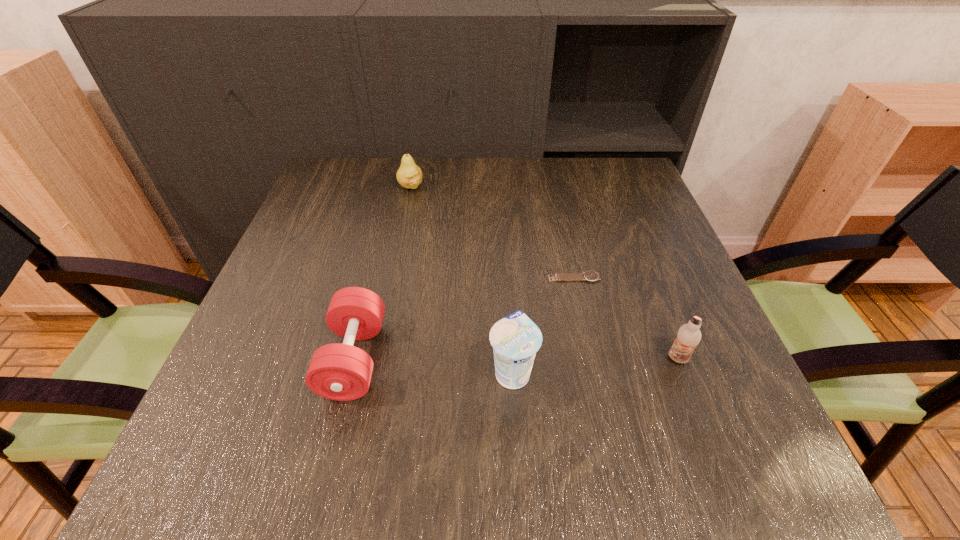
At what (x,y) coordinates should I click in order to perform the action: click on the farthest object. Please return your answer as a coordinate pair (x, y). The height and width of the screenshot is (540, 960). Looking at the image, I should click on (409, 175).

Where is `chocolate milk`? The width and height of the screenshot is (960, 540). chocolate milk is located at coordinates (688, 337).

The width and height of the screenshot is (960, 540). I want to click on yogurt, so click(515, 339).

This screenshot has height=540, width=960. I want to click on dumbbell, so click(x=342, y=372).

At what (x,y) coordinates should I click in order to perform the action: click on the fourth object from left to right. Please return your answer as a coordinate pair (x, y). This screenshot has width=960, height=540. Looking at the image, I should click on (591, 276).

Identify the location of the shortest object. Image resolution: width=960 pixels, height=540 pixels. (591, 276).

Locate an element on the screen. The width and height of the screenshot is (960, 540). free spot located on the front of the farthest object is located at coordinates (403, 221).

Locate an element on the screen. The image size is (960, 540). free space located 0.110m on the left of the chocolate milk is located at coordinates (605, 359).

Where is `vacant space located on the right of the third object from right to left`? The width and height of the screenshot is (960, 540). vacant space located on the right of the third object from right to left is located at coordinates (571, 372).

You are a GUI agent. You are given a task and a screenshot of the screen. Output one action in this format:
    pyautogui.click(x=<x>, y=<y>)
    Task: Click on the vacant space located 0.380m on the right of the dumbbell
    This screenshot has width=960, height=540.
    Given the screenshot: What is the action you would take?
    pyautogui.click(x=595, y=359)